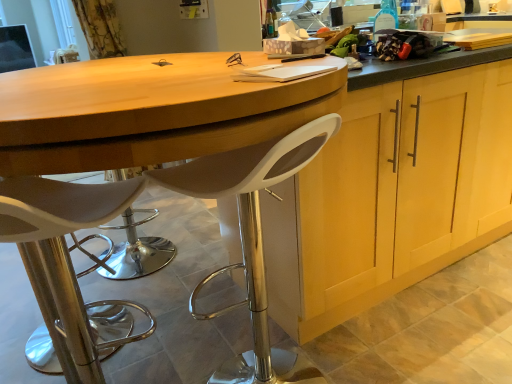
Locate an element on the screen. Image resolution: width=512 pixels, height=384 pixels. matte wood cabinet at center is located at coordinates (404, 189).

Image resolution: width=512 pixels, height=384 pixels. Find the location of `matte wood cabinet at center`. matte wood cabinet at center is located at coordinates (404, 189).

Who is more distant, white plastic stool at lower left, the 1th chair when ordered from left to right, or white plastic stool at center, the 2th chair positioned from the left?

white plastic stool at center, the 2th chair positioned from the left, is behind.

Based on the photo, which is more to the right, white plastic stool at lower left, the 1th chair when ordered from left to right, or white plastic stool at center, the first chair when ordered from right to left?

Positioned to the right is white plastic stool at center, the first chair when ordered from right to left.

Considering the sizes of objects white plastic stool at lower left, which ranks as the second chair in right-to-left order, and white plastic stool at center, the 2th chair positioned from the left, in the image provided, who is thinner, white plastic stool at lower left, which ranks as the second chair in right-to-left order, or white plastic stool at center, the 2th chair positioned from the left,?

Thinner between the two is white plastic stool at lower left, which ranks as the second chair in right-to-left order.

Consider the image. Looking at their sizes, would you say white plastic stool at center, the first chair when ordered from right to left, is wider or thinner than white plastic stool at lower left, which ranks as the second chair in right-to-left order?

white plastic stool at center, the first chair when ordered from right to left, is wider than white plastic stool at lower left, which ranks as the second chair in right-to-left order.

Is point (301, 145) closer to viewer compared to point (5, 185)?

That is True.

Does white plastic stool at center, the 2th chair positioned from the left, turn towards white plastic stool at lower left, the 1th chair when ordered from left to right?

No, white plastic stool at center, the 2th chair positioned from the left, is not turned towards white plastic stool at lower left, the 1th chair when ordered from left to right.

In order to click on chair located underneath the white plastic stool at lower left, the 1th chair when ordered from left to right (from a real-world perspective) in this screenshot , I will do `click(249, 230)`.

How much distance is there between matte wood cabinet at center and white plastic stool at center, the 2th chair positioned from the left?

A distance of 41.45 centimeters exists between matte wood cabinet at center and white plastic stool at center, the 2th chair positioned from the left.

Is matte wood cabinet at center located outside white plastic stool at center, the first chair when ordered from right to left?

Absolutely, matte wood cabinet at center is external to white plastic stool at center, the first chair when ordered from right to left.

Is matte wood cabinet at center further to the viewer compared to white plastic stool at center, the 2th chair positioned from the left?

Yes, it is behind white plastic stool at center, the 2th chair positioned from the left.

From the image's perspective, is matte wood cabinet at center beneath white plastic stool at center, the first chair when ordered from right to left?

Result: No, from the image's perspective, matte wood cabinet at center is not beneath white plastic stool at center, the first chair when ordered from right to left.

In the scene shown: Can you confirm if white plastic stool at center, the first chair when ordered from right to left, is smaller than matte wood cabinet at center?

Yes, white plastic stool at center, the first chair when ordered from right to left, is smaller than matte wood cabinet at center.

The width and height of the screenshot is (512, 384). In order to click on cabinetry above the white plastic stool at center, the first chair when ordered from right to left (from the image's perspective) in this screenshot , I will do `click(404, 189)`.

Based on the photo, measure the distance from white plastic stool at center, the 2th chair positioned from the left, to matte wood cabinet at center.

The distance of white plastic stool at center, the 2th chair positioned from the left, from matte wood cabinet at center is 16.32 inches.

Which object is more forward, white plastic stool at center, the first chair when ordered from right to left, or matte wood cabinet at center?

white plastic stool at center, the first chair when ordered from right to left, is in front.

Identify the location of cabinetry that appears behind the white plastic stool at lower left, which ranks as the second chair in right-to-left order. The width and height of the screenshot is (512, 384). (404, 189).

Which of these two, white plastic stool at lower left, which ranks as the second chair in right-to-left order, or matte wood cabinet at center, stands taller?

matte wood cabinet at center is taller.

Which is correct: white plastic stool at lower left, which ranks as the second chair in right-to-left order, is inside matte wood cabinet at center, or outside of it?

white plastic stool at lower left, which ranks as the second chair in right-to-left order, lies outside matte wood cabinet at center.

Is white plastic stool at lower left, the 1th chair when ordered from left to right, facing away from matte wood cabinet at center?

white plastic stool at lower left, the 1th chair when ordered from left to right, does not have its back to matte wood cabinet at center.

From the image's perspective, is matte wood cabinet at center under white plastic stool at lower left, which ranks as the second chair in right-to-left order?

Incorrect, from the image's perspective, matte wood cabinet at center is higher than white plastic stool at lower left, which ranks as the second chair in right-to-left order.

From a real-world perspective, is matte wood cabinet at center above or below white plastic stool at lower left, the 1th chair when ordered from left to right?

matte wood cabinet at center is situated higher than white plastic stool at lower left, the 1th chair when ordered from left to right, in the real world.

How different are the orientations of matte wood cabinet at center and white plastic stool at lower left, which ranks as the second chair in right-to-left order, in degrees?

43.1 degrees.

Would you say matte wood cabinet at center is inside or outside white plastic stool at lower left, which ranks as the second chair in right-to-left order?

matte wood cabinet at center lies outside white plastic stool at lower left, which ranks as the second chair in right-to-left order.

Locate an element on the screen. The width and height of the screenshot is (512, 384). chair located above the white plastic stool at center, the 2th chair positioned from the left (from a real-world perspective) is located at coordinates (64, 258).

Locate an element on the screen. chair lying in front of the white plastic stool at center, the 2th chair positioned from the left is located at coordinates (64, 258).

Considering their positions, is matte wood cabinet at center positioned further to white plastic stool at center, the first chair when ordered from right to left, than white plastic stool at lower left, which ranks as the second chair in right-to-left order?

matte wood cabinet at center is further to white plastic stool at center, the first chair when ordered from right to left.

Looking at the image, which one is located closer to matte wood cabinet at center, white plastic stool at lower left, which ranks as the second chair in right-to-left order, or white plastic stool at center, the 2th chair positioned from the left?

Based on the image, white plastic stool at center, the 2th chair positioned from the left, appears to be nearer to matte wood cabinet at center.

In the scene shown: From the image, which object appears to be farther from white plastic stool at center, the first chair when ordered from right to left, white plastic stool at lower left, which ranks as the second chair in right-to-left order, or matte wood cabinet at center?

Among the two, matte wood cabinet at center is located further to white plastic stool at center, the first chair when ordered from right to left.

Estimate the real-world distances between objects in this image. Which object is further from white plastic stool at lower left, the 1th chair when ordered from left to right, white plastic stool at center, the 2th chair positioned from the left, or matte wood cabinet at center?

matte wood cabinet at center.

Based on their spatial positions, is white plastic stool at center, the first chair when ordered from right to left, or white plastic stool at lower left, the 1th chair when ordered from left to right, closer to matte wood cabinet at center?

The object closer to matte wood cabinet at center is white plastic stool at center, the first chair when ordered from right to left.

Consider the image. Considering their positions, is matte wood cabinet at center positioned further to white plastic stool at lower left, which ranks as the second chair in right-to-left order, than white plastic stool at center, the 2th chair positioned from the left?

matte wood cabinet at center is positioned further to the anchor white plastic stool at lower left, which ranks as the second chair in right-to-left order.

Identify the location of chair between white plastic stool at lower left, the 1th chair when ordered from left to right, and matte wood cabinet at center from left to right. This screenshot has width=512, height=384. (249, 230).